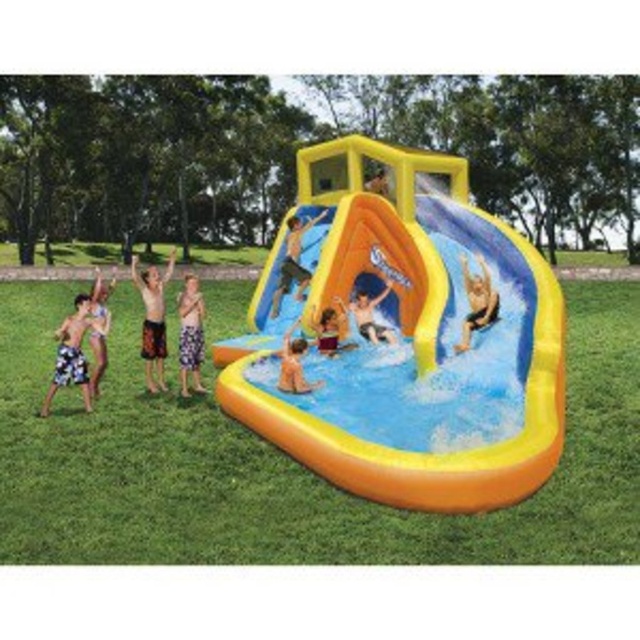
You are a parent supervising children at the water park. You see a child wearing the smooth yellow swim trunks at center and another child near the smooth yellow slide at center. Which child is standing to the right of the slide?

The child wearing the smooth yellow swim trunks at center is standing to the right of the smooth yellow slide at center because the swim trunks are positioned on the right side of the slide.

Consider the image. You are standing at the entrance of the inflatable water park and want to locate the inflatable yellow at center. According to the coordinates provided, where should you look to find it?

The inflatable yellow at center is located at point coordinates 0.709 on the x axis and 0.670 on the y axis.

You are a parent supervising at the inflatable water park. You notice the inflatable yellow at center and the tan skin man at center. Which object is smaller in size?

The inflatable yellow at center is smaller in size compared to the tan skin man at center.